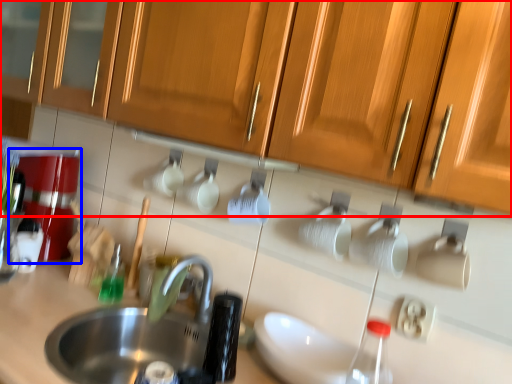
Question: Which point is further to the camera, cabinetry (highlighted by a red box) or coffee machine (highlighted by a blue box)?

Choices:
 (A) cabinetry
 (B) coffee machine

Answer: (B)